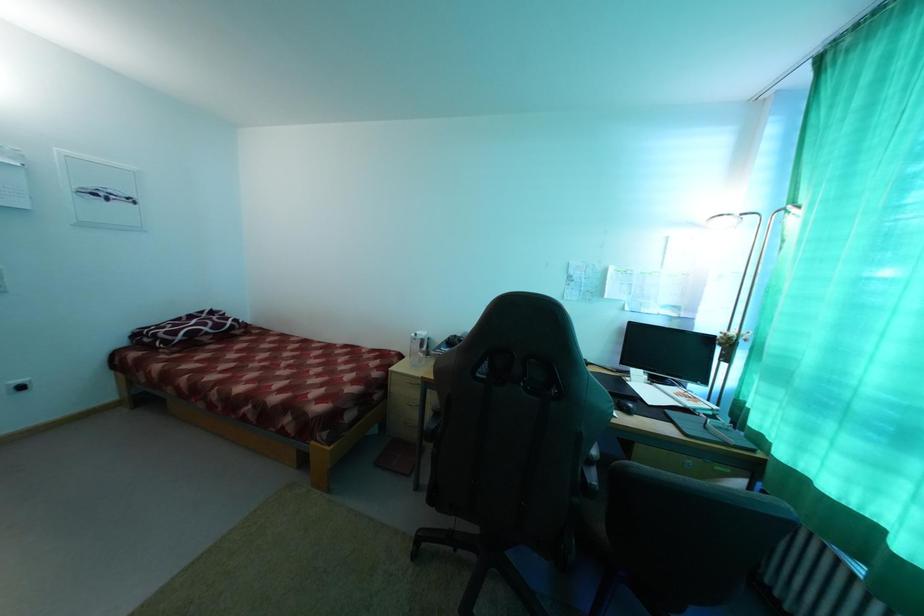
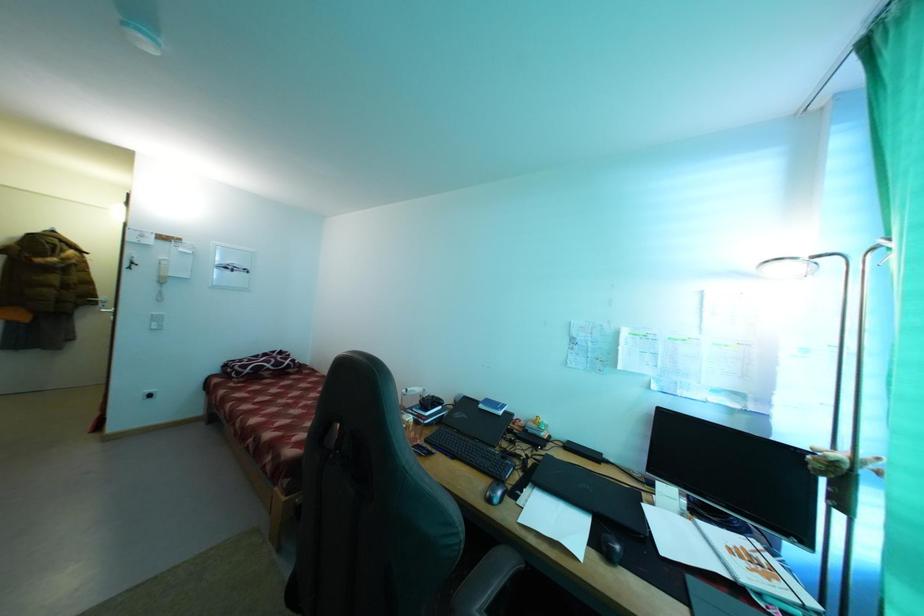
Question: The camera is either moving clockwise (left) or counter-clockwise (right) around the object. The first image is from the beginning of the video and the second image is from the end. Is the camera moving left or right when shooting the video?

Choices:
 (A) Left
 (B) Right

Answer: (B)